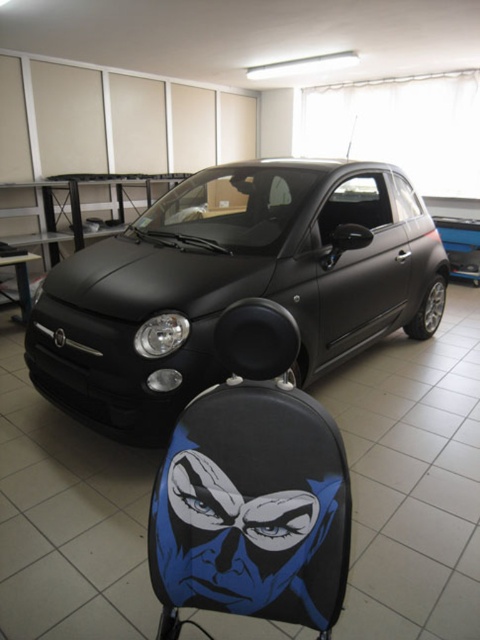
Who is higher up, matte black car at center or blue matte/comic book character at center?

matte black car at center is higher up.

Measure the distance between matte black car at center and camera.

A distance of 6.95 feet exists between matte black car at center and camera.

Is point (333, 221) positioned after point (323, 522)?

Yes, point (333, 221) is farther from viewer.

Identify the location of matte black car at center. (233, 285).